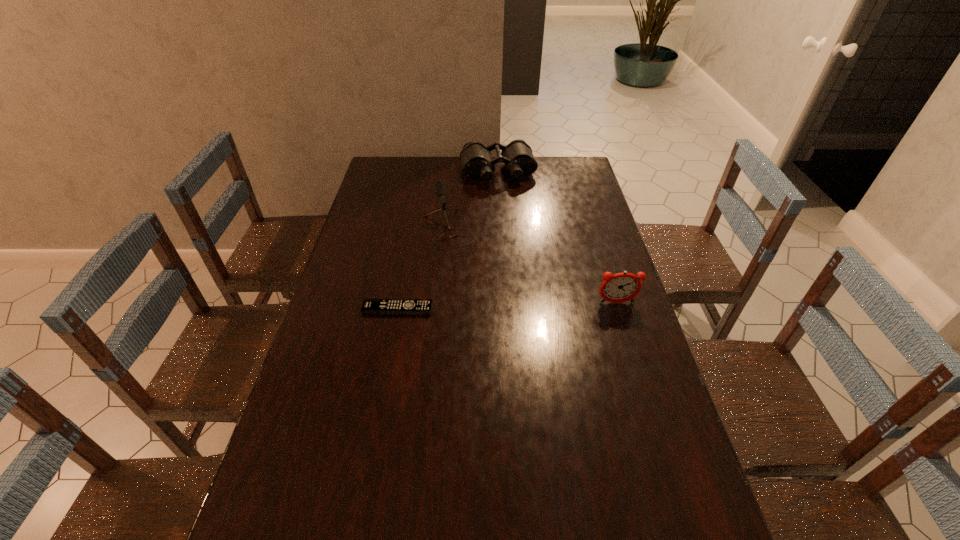
You are a GUI agent. You are given a task and a screenshot of the screen. Output one action in this format:
    pyautogui.click(x=<x>, y=<y>)
    Task: Click on the free point located 0.130m through the eyepieces of the binoculars
    
    Given the screenshot: What is the action you would take?
    pyautogui.click(x=508, y=205)

This screenshot has width=960, height=540. What are the coordinates of `free space located through the eyepieces of the binoculars` in the screenshot? It's located at click(x=505, y=194).

Identify the location of free space located through the eyepieces of the binoculars. (513, 224).

Where is `object that is at the far edge`? The image size is (960, 540). object that is at the far edge is located at coordinates (477, 163).

Where is `object that is positioned at the left edge`? The height and width of the screenshot is (540, 960). object that is positioned at the left edge is located at coordinates (370, 306).

Find the location of `object located in the right edge section of the desktop`. object located in the right edge section of the desktop is located at coordinates (621, 287).

At what (x,y) coordinates should I click in order to perform the action: click on vacant space at the far edge. Please return your answer as a coordinate pair (x, y). Looking at the image, I should click on [x=544, y=184].

Find the location of a particular element. vacant point at the left edge is located at coordinates (268, 485).

At what (x,y) coordinates should I click in order to perform the action: click on vacant space at the right edge. Please return your answer as a coordinate pair (x, y). This screenshot has width=960, height=540. Looking at the image, I should click on (627, 389).

In the image, there is a desktop. Identify the location of vacant space at the far right corner. (585, 171).